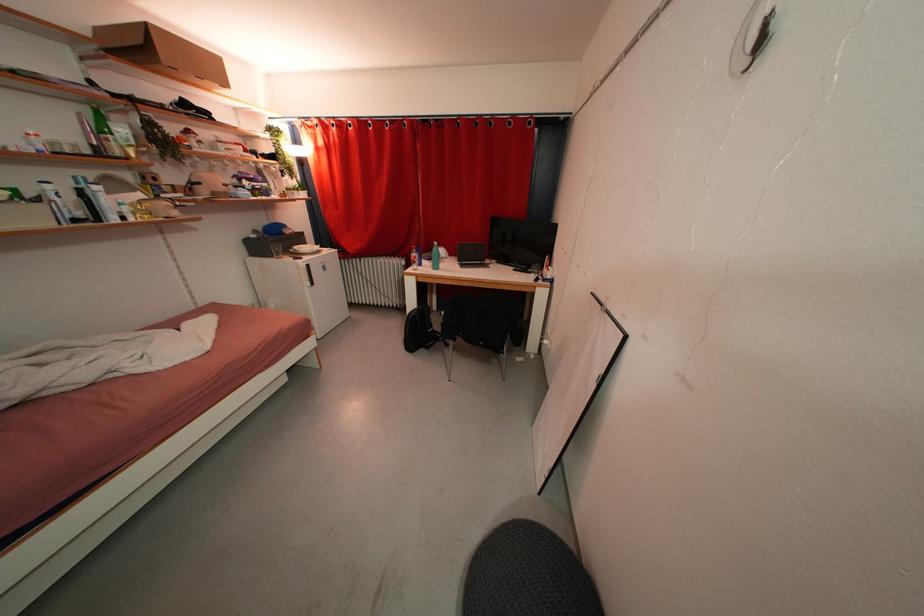
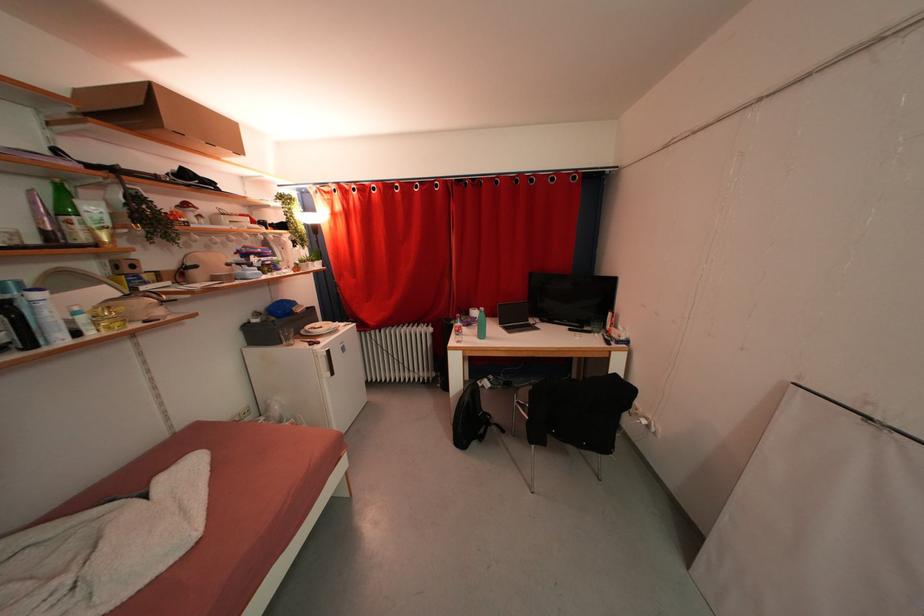
Locate, in the second image, the point that corresponds to (214,71) in the first image.

(226, 137)